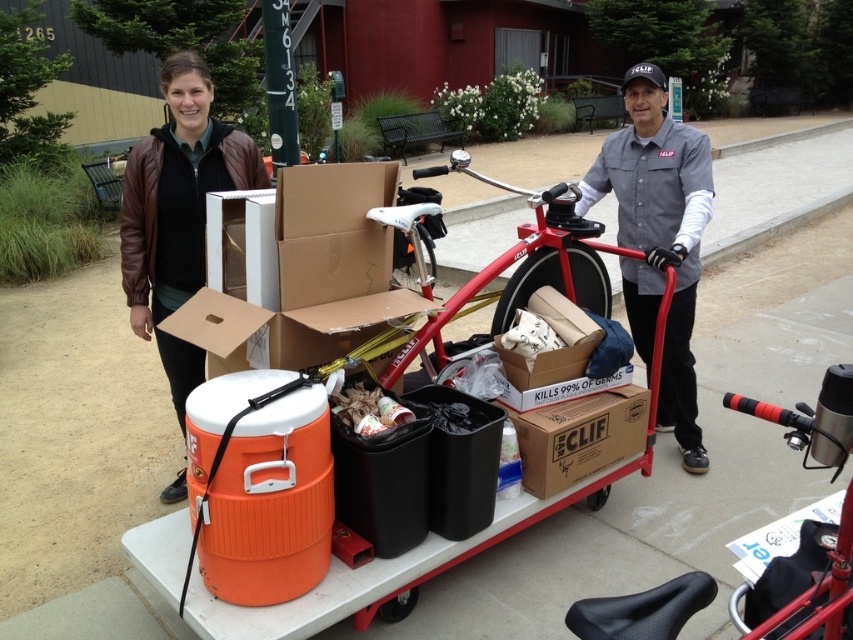
Question: Which object is closer to the camera taking this photo?

Choices:
 (A) red matte bicycle at center
 (B) gray/denim shirt at center

Answer: (A)

Question: Is brown leather jacket at upper left bigger than red matte bicycle at center?

Choices:
 (A) no
 (B) yes

Answer: (B)

Question: From the image, what is the correct spatial relationship of gray/denim shirt at center in relation to brown leather jacket at upper left?

Choices:
 (A) left
 (B) right

Answer: (B)

Question: Considering the real-world distances, which object is farthest from the red matte bicycle at center?

Choices:
 (A) gray/denim shirt at center
 (B) brown leather jacket at upper left

Answer: (B)

Question: Is gray/denim shirt at center closer to camera compared to brown leather jacket at upper left?

Choices:
 (A) no
 (B) yes

Answer: (A)

Question: Estimate the real-world distances between objects in this image. Which object is closer to the brown leather jacket at upper left?

Choices:
 (A) red matte bicycle at center
 (B) gray/denim shirt at center

Answer: (B)